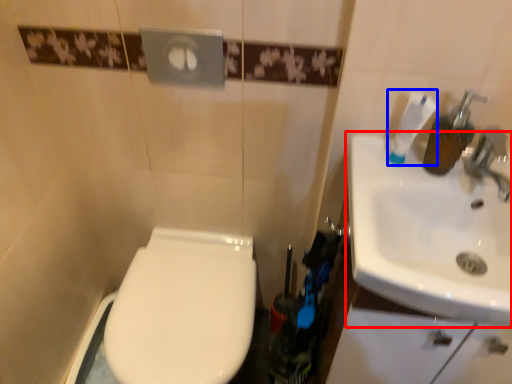
Question: Which of the following is the closest to the observer, sink (highlighted by a red box) or toothpaste (highlighted by a blue box)?

Choices:
 (A) sink
 (B) toothpaste

Answer: (A)